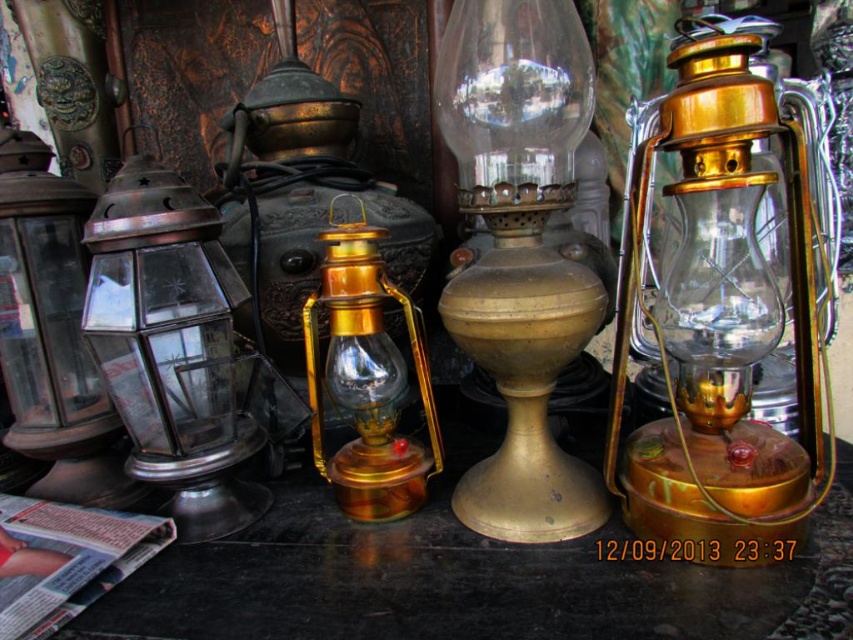
You are standing in front of the display of vintage lamps. There are two points marked on the image. The first point is at coordinates point (732,625) and the second is at point (735,468). Which point is closer to you?

Point (732,625) is closer to the viewer than point (735,468).

You are a delivery person who needs to place a box that is 10 cm tall on the shiny black table at center. The gold brass oil lamp at center is in the way. Can you place the box on the table without moving the lamp?

The shiny black table at center has a lesser height compared to gold brass oil lamp at center, so the lamp might block access to the table surface. However, since the box is only 10 cm tall and the table is shorter than the lamp, you can likely place the box on the table without moving the lamp as long as there is enough space around the lamp base.